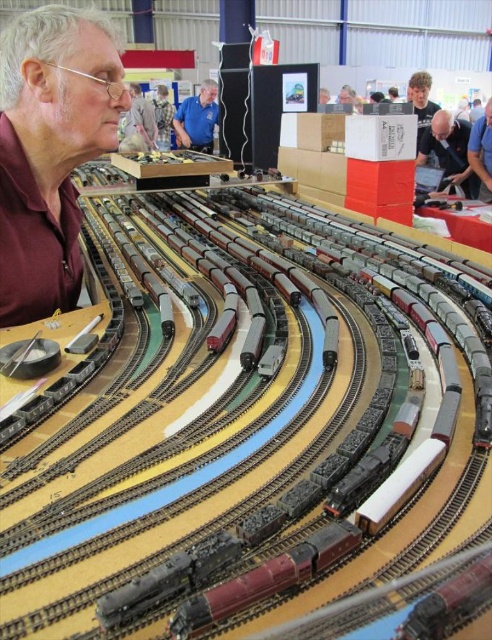
You are a photographer at the exhibition and want to capture a clear photo of the model railway without any people blocking it. The matte brown shirt at left and the blonde hair at upper right are currently in the frame. Based on their positions, which one should you ask to move back so the other can stay in the background?

The matte brown shirt at left is in front of blonde hair at upper right, so you should ask the person with the matte brown shirt at left to move back so the blonde hair at upper right can stay in the background.

You are a photographer at the exhibition and want to capture both the matte brown shirt at left and the camouflage fabric shirt at center in a single photo. Based on their positions, which shirt should you focus on first to ensure both are in the frame?

The matte brown shirt at left is below the camouflage fabric shirt at center, so you should focus on the camouflage fabric shirt at center first to ensure both are in the frame.

You are a photographer at the exhibition and want to capture both the light brown leather jacket at upper center and the camouflage fabric shirt at center in a single photo. Based on their positions, which one should you focus on first to ensure both are in frame?

The light brown leather jacket at upper center is below the camouflage fabric shirt at center. To capture both in a single photo, focus on the camouflage fabric shirt at center first as it is higher up, ensuring the jacket below is also within the frame.